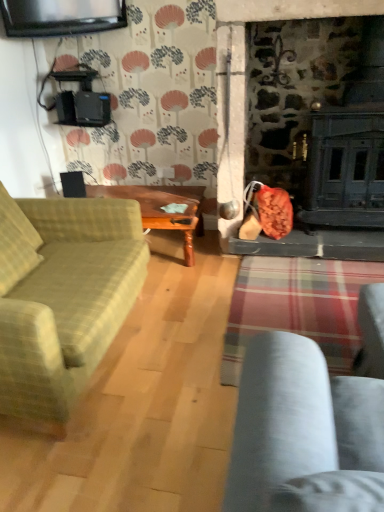
Question: From a real-world perspective, relative to green plaid fabric couch at left, is wooden polished table at center vertically above or below?

Choices:
 (A) below
 (B) above

Answer: (A)

Question: Does point (91, 188) appear closer or farther from the camera than point (3, 268)?

Choices:
 (A) farther
 (B) closer

Answer: (A)

Question: Looking at the image, does wooden polished table at center seem bigger or smaller compared to green plaid fabric couch at left?

Choices:
 (A) small
 (B) big

Answer: (A)

Question: Looking at the image, does green plaid fabric couch at left seem bigger or smaller compared to wooden polished table at center?

Choices:
 (A) small
 (B) big

Answer: (B)

Question: From the image's perspective, is green plaid fabric couch at left located above or below wooden polished table at center?

Choices:
 (A) below
 (B) above

Answer: (A)

Question: Is green plaid fabric couch at left taller or shorter than wooden polished table at center?

Choices:
 (A) tall
 (B) short

Answer: (A)

Question: Is green plaid fabric couch at left spatially inside wooden polished table at center, or outside of it?

Choices:
 (A) inside
 (B) outside

Answer: (B)